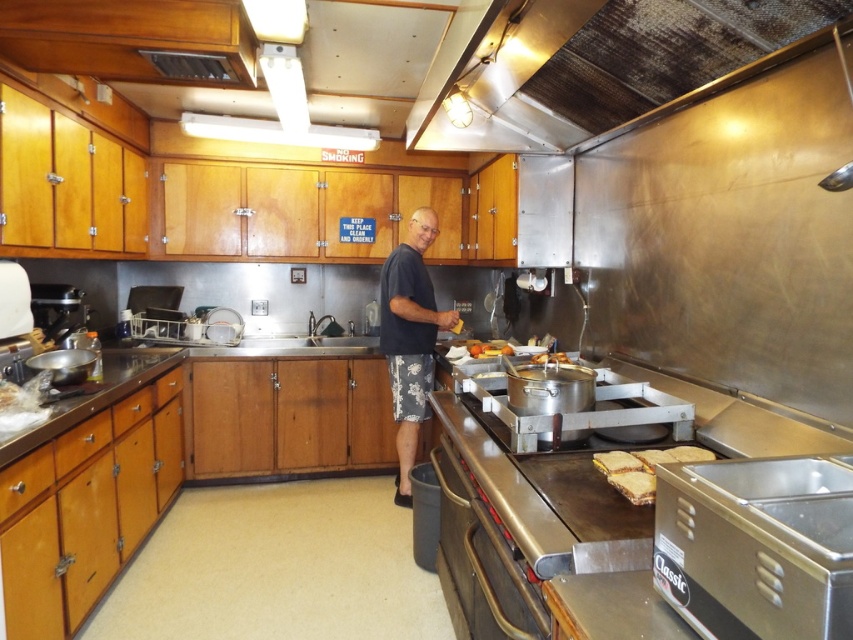
You are a food truck worker who needs to place a large cutting board on the counter. The metallic at upper center and the satin silver sink at center are both on the counter. Which area has more space for the cutting board?

The metallic at upper center has more space because its width surpasses the satin silver sink at center.

You are a chef working in this kitchen and need to store a large pot. The metallic at upper center and the satin silver sink at center are both in your line of sight. Which storage area can accommodate the pot based on their sizes?

The metallic at upper center has a larger size compared to the satin silver sink at center, so the large pot can be stored in the metallic at upper center.